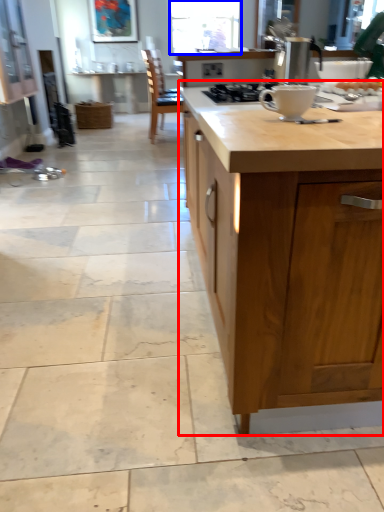
Question: Which object appears closest to the camera in this image, countertop (highlighted by a red box) or window screen (highlighted by a blue box)?

Choices:
 (A) countertop
 (B) window screen

Answer: (A)